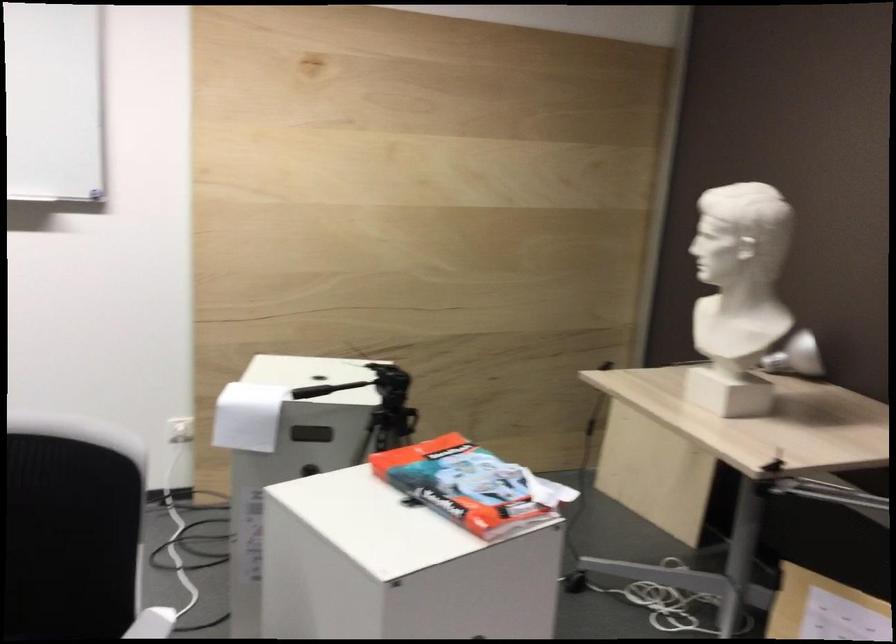
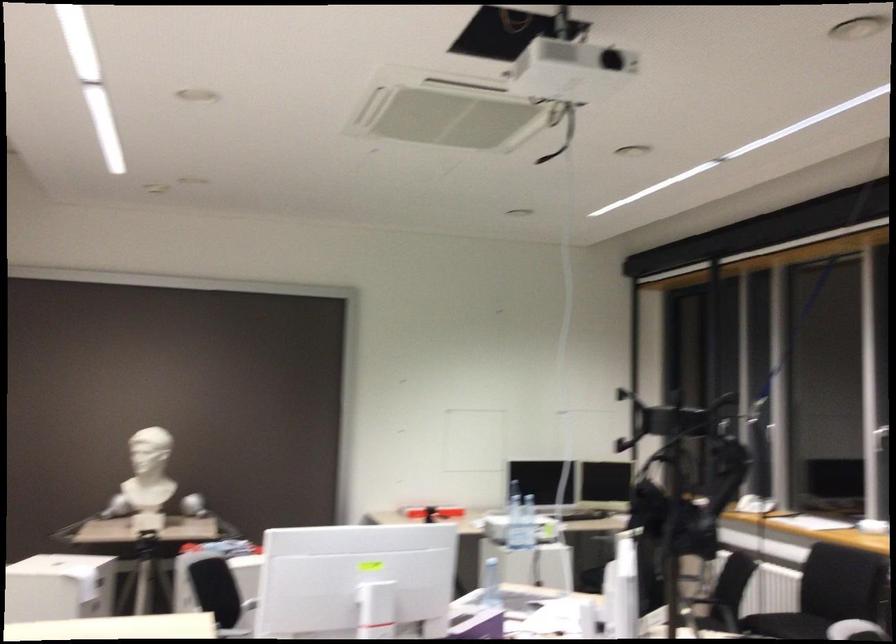
Locate, in the second image, the point that corresponds to point 746,281 in the first image.

(179, 457)